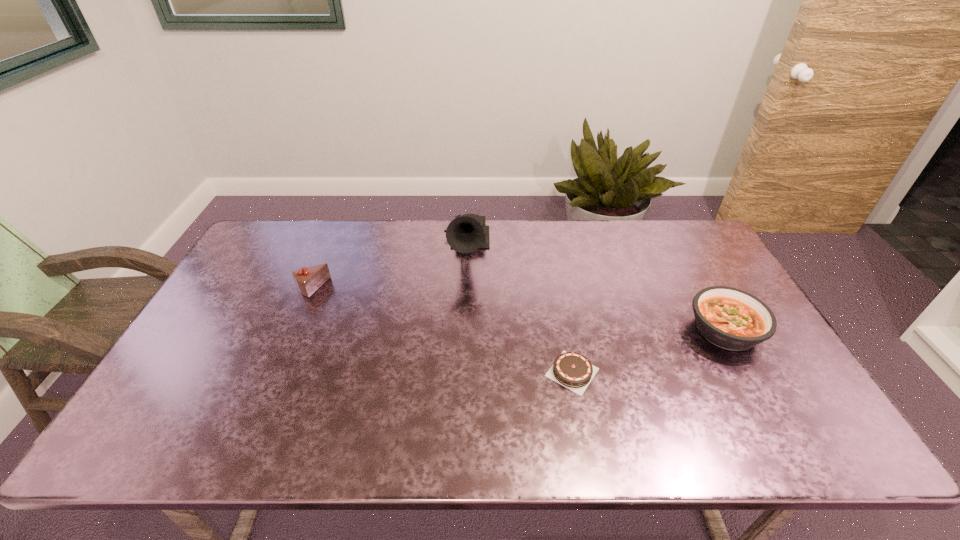
I want to click on phonograph_record, so click(x=466, y=233).

This screenshot has height=540, width=960. What are the coordinates of `the tallest object` in the screenshot? It's located at pos(466,233).

Find the location of a particular element. The width and height of the screenshot is (960, 540). the farther chocolate cake is located at coordinates (308, 279).

Where is `the leftmost object`? The image size is (960, 540). the leftmost object is located at coordinates (308, 279).

Find the location of `the rightmost object`. the rightmost object is located at coordinates (732, 319).

Find the location of a particular element. the third object from left to right is located at coordinates (572, 370).

I want to click on the shortest object, so click(572, 370).

This screenshot has height=540, width=960. In order to click on free space located 0.220m from the horn of the third object from right to left in this screenshot , I will do `click(464, 329)`.

Where is `vacant area situated 0.370m on the front of the left chocolate cake`? This screenshot has width=960, height=540. vacant area situated 0.370m on the front of the left chocolate cake is located at coordinates (261, 406).

Locate an element on the screen. Image resolution: width=960 pixels, height=540 pixels. free space located on the front of the rightmost object is located at coordinates (761, 396).